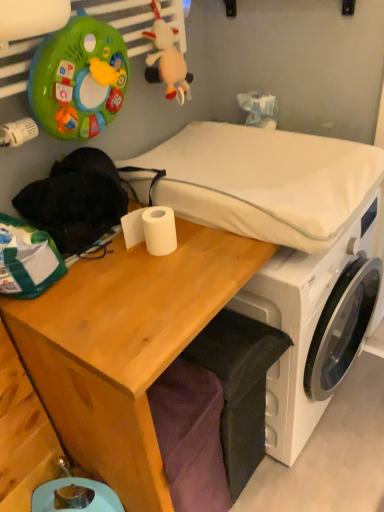
The image size is (384, 512). What are the coordinates of `vacant area that lies in front of white matte toilet paper at center` in the screenshot? It's located at (157, 290).